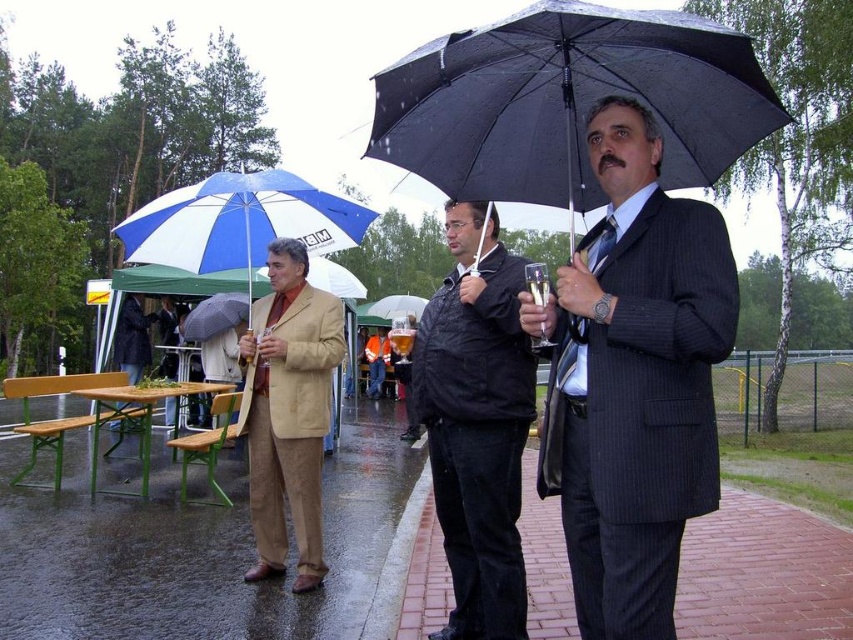
What do you see at coordinates (633, 380) in the screenshot? The width and height of the screenshot is (853, 640). I see `matte black suit at center` at bounding box center [633, 380].

Between point (666, 516) and point (689, 112), which one is positioned in front?

Point (666, 516) is in front.

Which is in front, point (643, 317) or point (593, 60)?

Point (643, 317)

The height and width of the screenshot is (640, 853). Find the location of `matte black suit at center`. matte black suit at center is located at coordinates (x=633, y=380).

Does matte black suit at center have a lesser height compared to beige fabric jacket at center?

No, matte black suit at center is not shorter than beige fabric jacket at center.

Is point (561, 406) positioned in front of point (296, 288)?

Yes, point (561, 406) is in front of point (296, 288).

Who is more forward, (683, 452) or (289, 490)?

Point (683, 452)

The width and height of the screenshot is (853, 640). I want to click on matte black suit at center, so click(x=633, y=380).

Between black matte umbrella at center and blue and white striped umbrella at left, which one has less height?

black matte umbrella at center

Is black matte umbrella at center closer to camera compared to blue and white striped umbrella at left?

Yes, it is in front of blue and white striped umbrella at left.

Which is behind, point (752, 68) or point (270, 195)?

Point (270, 195)

Where is `black matte umbrella at center`? The image size is (853, 640). black matte umbrella at center is located at coordinates (567, 100).